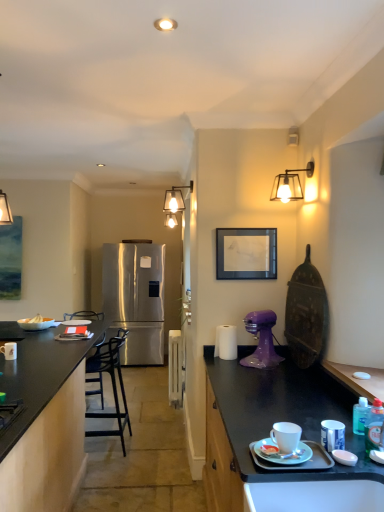
In order to click on blank area beneath matte glass lamp at center, which is counted as the first lamp, starting from the back (from a real-world perspective) in this screenshot , I will do `click(173, 455)`.